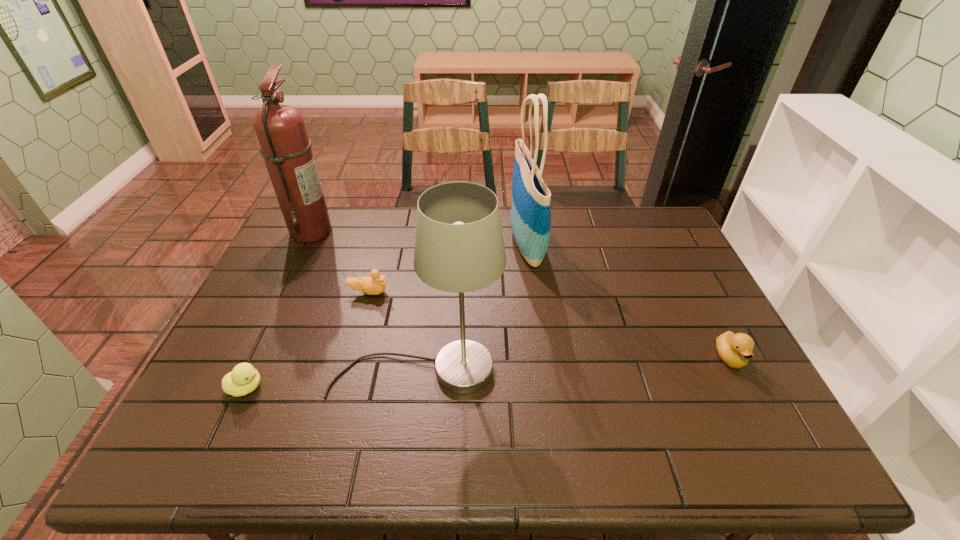
Image resolution: width=960 pixels, height=540 pixels. I want to click on fire extinguisher, so click(x=280, y=130).

Identify the location of the fifth object from left to right. (530, 218).

Where is `table lamp`? The image size is (960, 540). table lamp is located at coordinates (459, 247).

What are the coordinates of `the rightmost duckling` in the screenshot? It's located at (735, 350).

I want to click on the second duckling from right to left, so click(375, 284).

Identify the location of the farthest duckling. Image resolution: width=960 pixels, height=540 pixels. (375, 284).

The height and width of the screenshot is (540, 960). What are the coordinates of `the leftmost duckling` in the screenshot? It's located at (244, 378).

I want to click on free location located 0.070m on the front-facing side of the fire extinguisher, so click(353, 231).

The image size is (960, 540). Find the location of `vacant space situated on the front of the second object from right to left`. vacant space situated on the front of the second object from right to left is located at coordinates (540, 353).

You are a GUI agent. You are given a task and a screenshot of the screen. Output one action in this format:
    pyautogui.click(x=<x>, y=<y>)
    Task: Click on the free region located 0.090m on the back of the table lamp
    The image size is (960, 540).
    Given the screenshot: What is the action you would take?
    pyautogui.click(x=424, y=316)